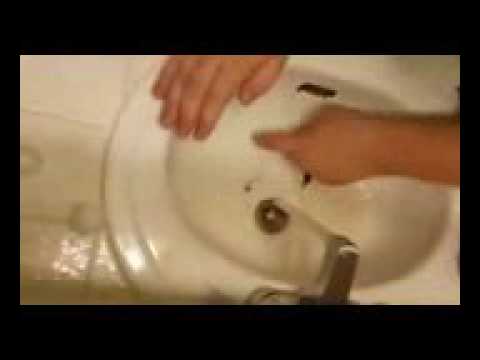
Identify the location of tile countertop. The height and width of the screenshot is (360, 480). (91, 127).